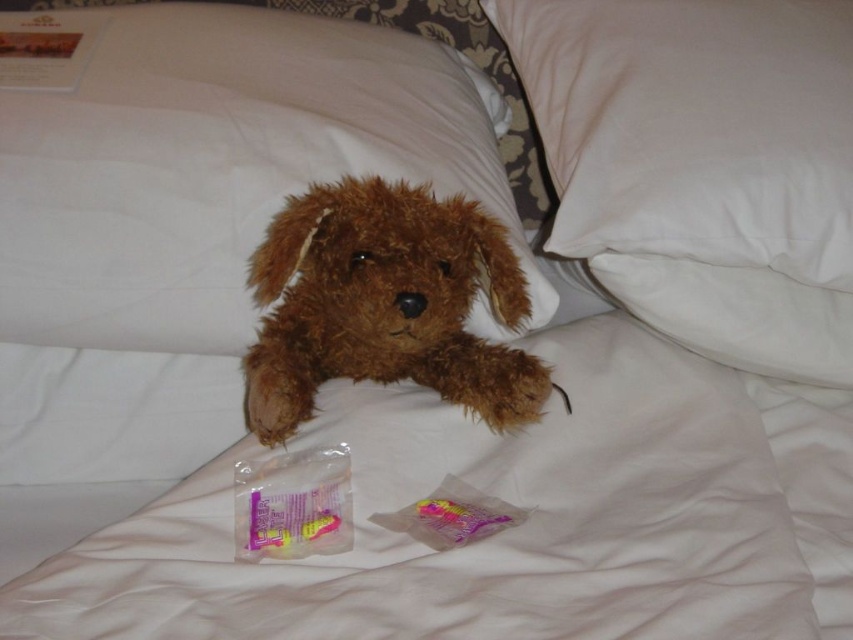
Who is more distant from viewer, [724,193] or [647,259]?

The point [647,259] is more distant.

Is white soft pillow at upper right shorter than white cotton pillow at upper right?

Incorrect, white soft pillow at upper right's height does not fall short of white cotton pillow at upper right's.

Describe the element at coordinates (694, 125) in the screenshot. I see `white soft pillow at upper right` at that location.

Where is `white soft pillow at upper right`? white soft pillow at upper right is located at coordinates (694, 125).

Does brown plush at upper center have a lesser width compared to white cotton pillow at upper right?

Incorrect, brown plush at upper center's width is not less than white cotton pillow at upper right's.

From the picture: Which is more to the right, brown plush at upper center or white cotton pillow at upper right?

white cotton pillow at upper right

Who is more forward, (x=151, y=252) or (x=814, y=298)?

Positioned in front is point (x=151, y=252).

The width and height of the screenshot is (853, 640). What are the coordinates of `brown plush at upper center` in the screenshot? It's located at (218, 164).

Locate an element on the screen. The image size is (853, 640). brown plush toy at center is located at coordinates (386, 305).

Does brown plush toy at center appear on the left side of white cotton pillow at upper right?

Correct, you'll find brown plush toy at center to the left of white cotton pillow at upper right.

You are a GUI agent. You are given a task and a screenshot of the screen. Output one action in this format:
    pyautogui.click(x=<x>, y=<y>)
    Task: Click on the brown plush toy at center
    This screenshot has width=853, height=640.
    Given the screenshot: What is the action you would take?
    pyautogui.click(x=386, y=305)